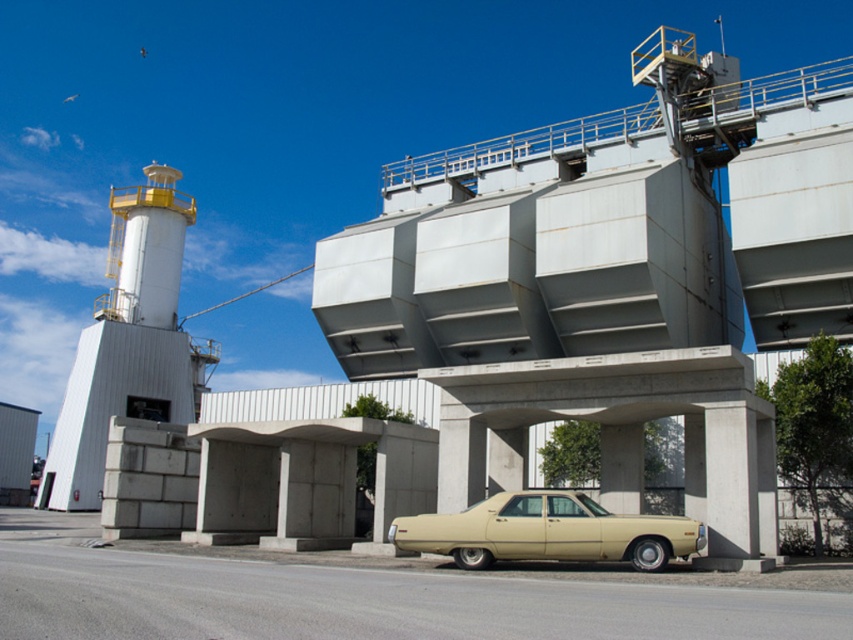
You are standing at the center of the industrial facility and see the point marked at coordinates (x=128, y=342). What object is located at that point?

The point at coordinates (x=128, y=342) corresponds to the white matte control tower at left.

You are a delivery driver approaching the industrial facility and need to park your beige matte sedan at center. The facility requires vehicles to be parked below the white matte control tower at left. Can you park your vehicle in the designated area?

The white matte control tower at left is located above the beige matte sedan at center, so yes, the beige matte sedan at center can be parked below the white matte control tower at left in the designated area.